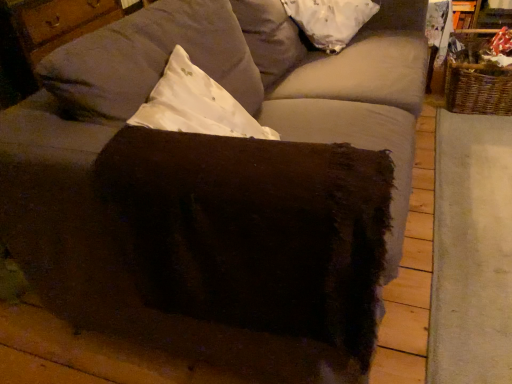
Question: Is point coord(463,64) closer or farther from the camera than point coord(290,173)?

Choices:
 (A) farther
 (B) closer

Answer: (A)

Question: From the image's perspective, is woven brown basket at right above or below brown fuzzy ottoman at center?

Choices:
 (A) below
 (B) above

Answer: (B)

Question: Considering the real-world distances, which object is closest to the brown fuzzy ottoman at center?

Choices:
 (A) woven brown basket at right
 (B) white fabric pillow at upper center

Answer: (B)

Question: Estimate the real-world distances between objects in this image. Which object is closer to the brown fuzzy ottoman at center?

Choices:
 (A) white fabric pillow at upper center
 (B) woven brown basket at right

Answer: (A)